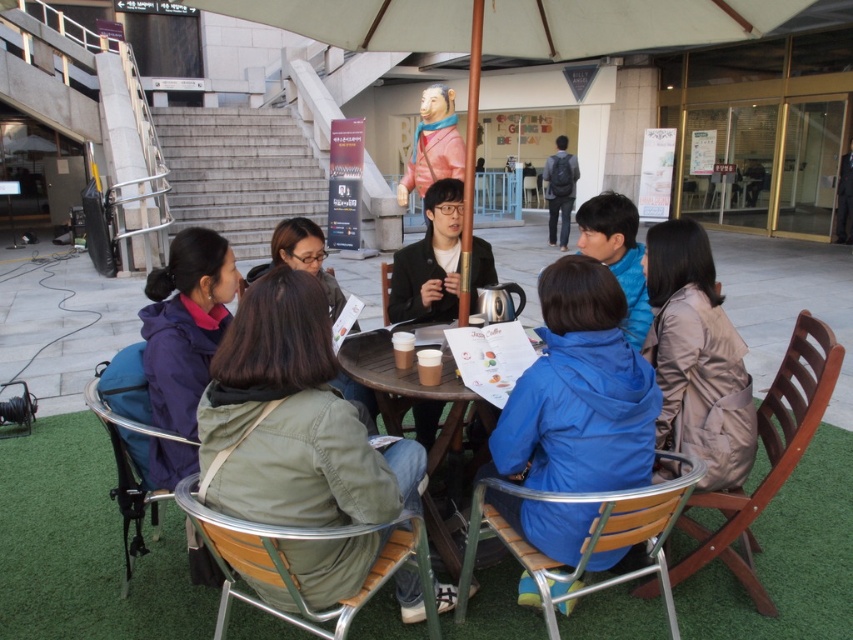
You are a photographer trying to capture a closeup of the blue matte jacket at center without including the brown wooden chair at lower right in the frame. Is this possible given their positions?

The blue matte jacket at center is positioned over the brown wooden chair at lower right, so it is likely covering the chair. Therefore, you can capture a closeup of the blue matte jacket at center without including the brown wooden chair at lower right in the frame.

You are a photographer trying to capture a closeup of the blue matte jacket at center without including the wooden chair at lower right in the frame. Given their relative sizes, is this possible?

The blue matte jacket at center is thinner than the wooden chair at lower right, so it is possible to capture a closeup of the blue matte jacket at center without including the wooden chair at lower right in the frame.